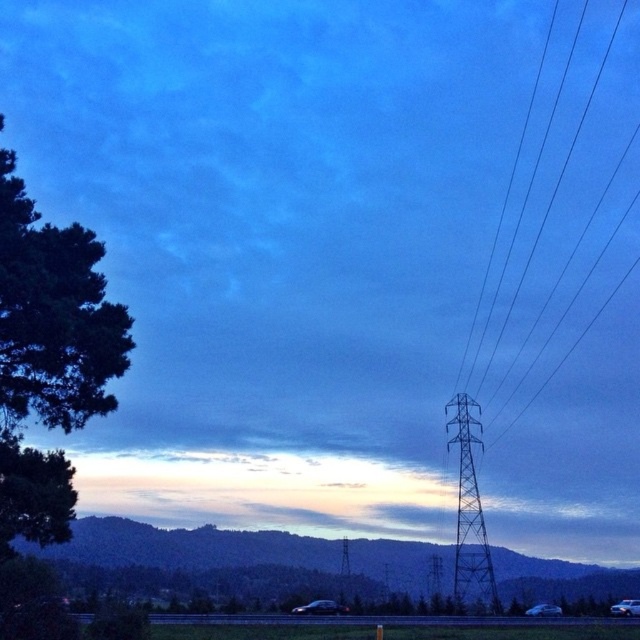
From the picture: You are a bird flying over the scene. You want to land on the closest object between the green leafy tree at left and the black wire at right. Which object should you choose?

The green leafy tree at left is to the left of black wire at right, so the green leafy tree at left is closer to you as you fly over the scene.